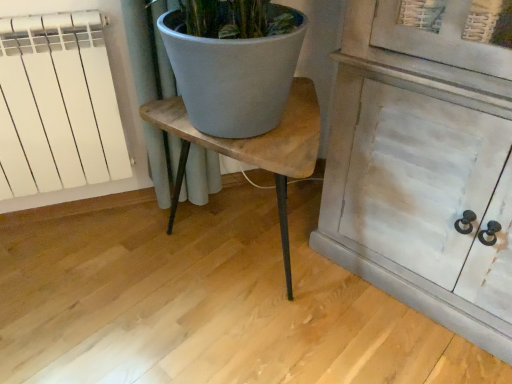
Identify the location of vacant space underneath white matte radiator at left (from a real-world perspective). The height and width of the screenshot is (384, 512). (74, 219).